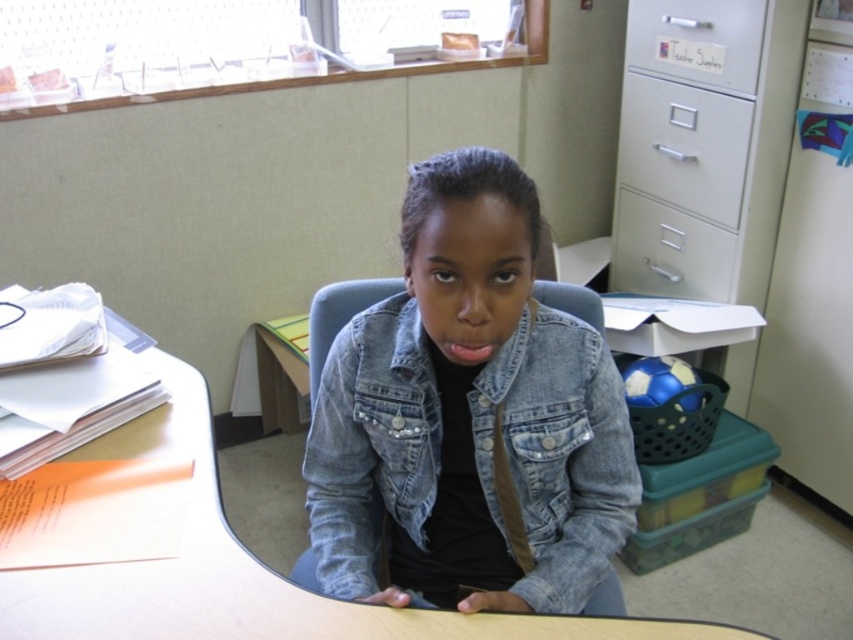
Question: Is denim jacket at center thinner than metallic silver drawer at upper right?

Choices:
 (A) no
 (B) yes

Answer: (A)

Question: Which point is closer to the camera?

Choices:
 (A) (635, 74)
 (B) (563, 336)
 (C) (741, 60)
 (D) (305, 605)

Answer: (D)

Question: Estimate the real-world distances between objects in this image. Which object is farther from the smooth wood desk at center?

Choices:
 (A) denim jacket at center
 (B) white matte file cabinet at upper right
 (C) metallic silver drawer at upper right
 (D) white plastic drawer at upper right

Answer: (D)

Question: Which of these objects is positioned farthest from the white matte file cabinet at upper right?

Choices:
 (A) denim jacket at center
 (B) smooth wood desk at center
 (C) white plastic drawer at upper right
 (D) metallic silver drawer at upper right

Answer: (B)

Question: Does white metal file cabinet at upper right appear over white plastic drawer at upper right?

Choices:
 (A) no
 (B) yes

Answer: (A)

Question: Does denim jacket at center have a larger size compared to white plastic drawer at upper right?

Choices:
 (A) yes
 (B) no

Answer: (A)